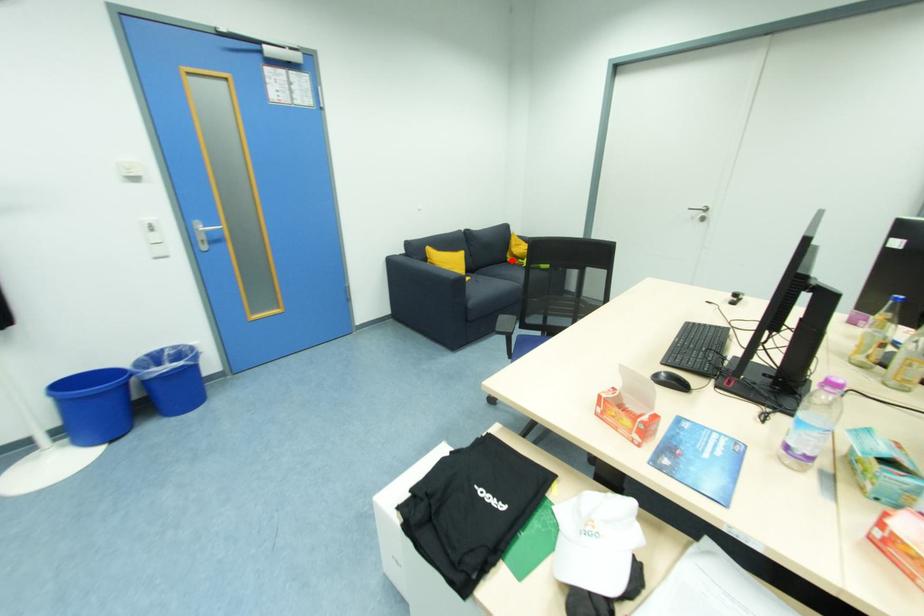
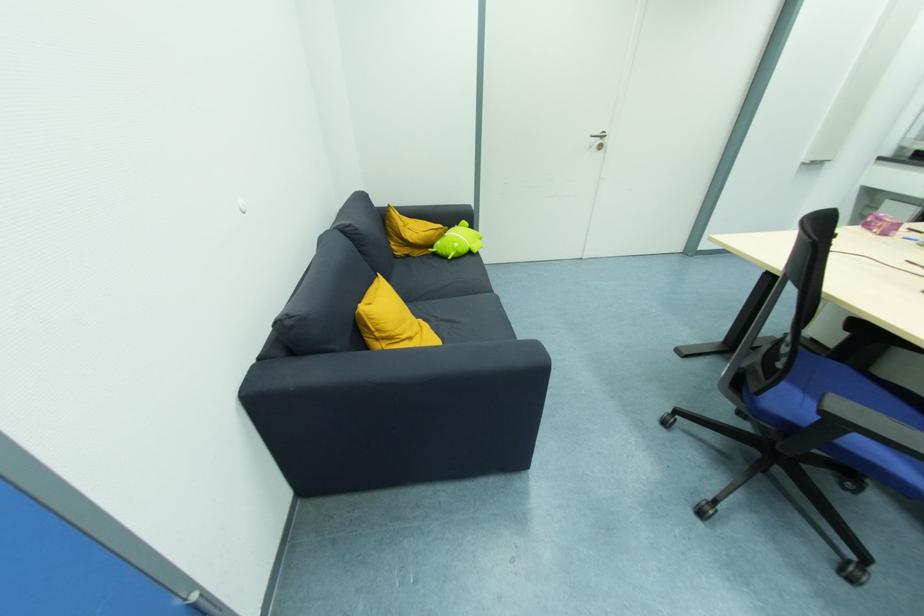
The point at the highlighted location is marked in the first image. Where is the corresponding point in the second image?

(403, 253)